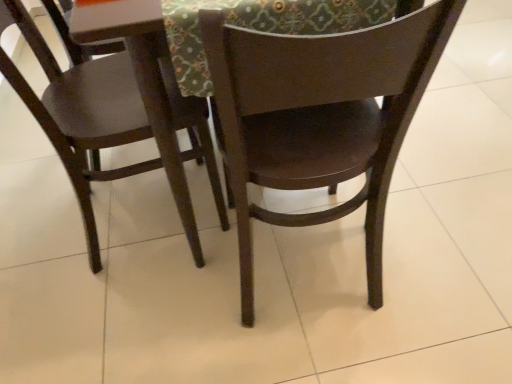
Locate an element on the screen. vacant space underneath matte wood chair at left, which ranks as the 2th chair in right-to-left order (from a real-world perspective) is located at coordinates (130, 215).